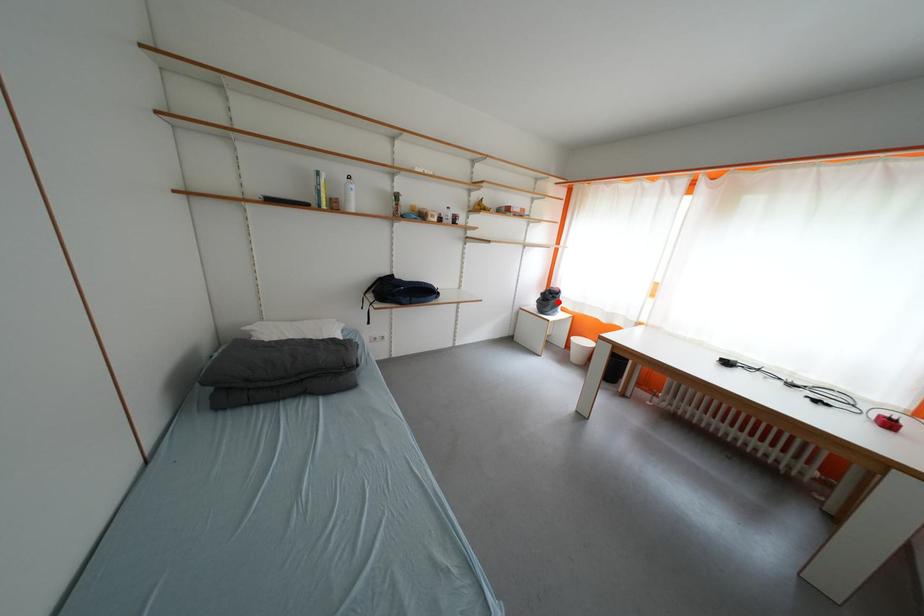
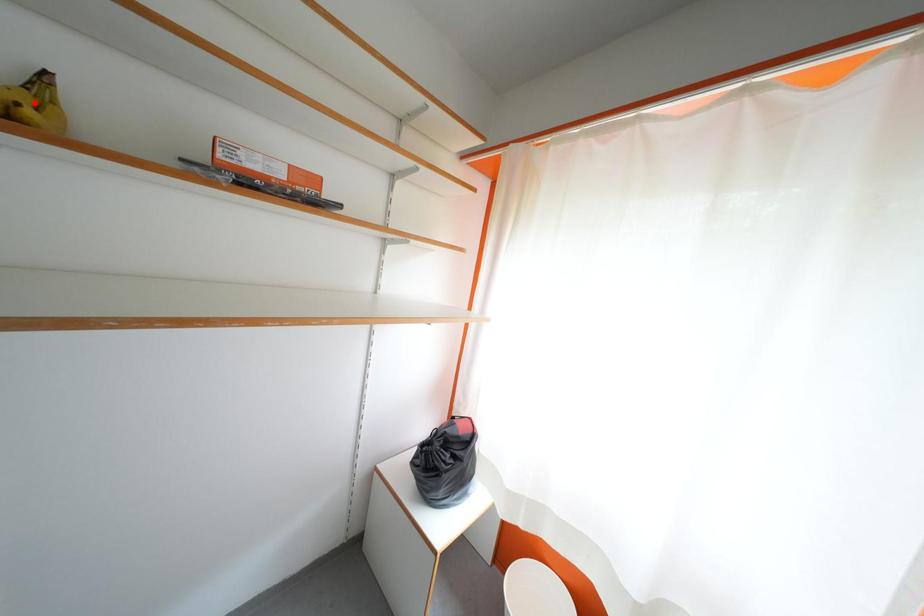
I am providing you with two images of the same scene from different viewpoints. A red point is marked on the first image and another point is marked on the second image. Is the red point in image1 aligned with the point shown in image2?

No